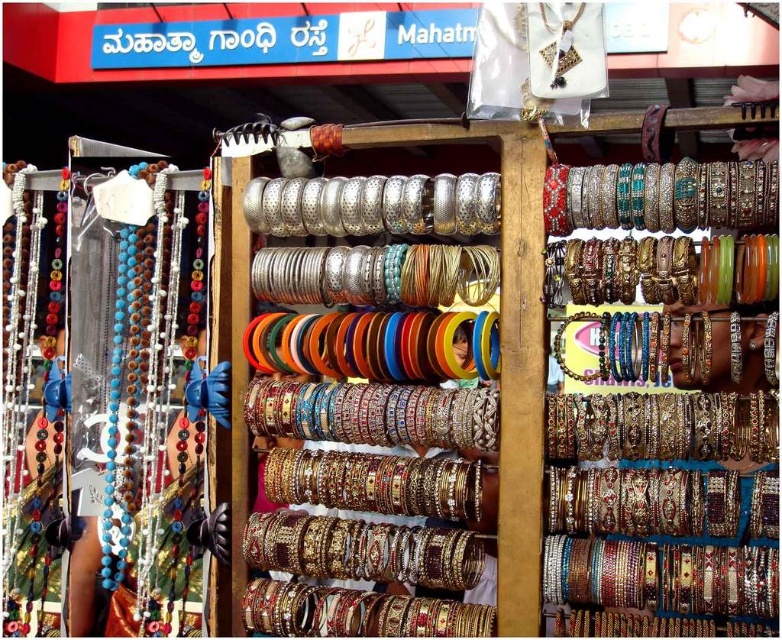
Is matte glass beads at left positioned in front of multicolored beaded bangles at center?

No.

Does matte glass beads at left come behind multicolored beaded bangles at center?

Yes, matte glass beads at left is behind multicolored beaded bangles at center.

From the picture: Who is more forward, [138,332] or [755,186]?

Positioned in front is point [755,186].

The image size is (782, 640). I want to click on matte glass beads at left, so click(92, 380).

How much distance is there between multicolored beaded bangles at center and metallic bangles at center?

multicolored beaded bangles at center is 15.32 inches away from metallic bangles at center.

Describe the element at coordinates (702, 317) in the screenshot. I see `multicolored beaded bangles at center` at that location.

Find the location of a particular element. multicolored beaded bangles at center is located at coordinates (702, 317).

Does matte glass beads at left appear on the right side of metallic bangles at center?

Incorrect, matte glass beads at left is not on the right side of metallic bangles at center.

Does matte glass beads at left come in front of metallic bangles at center?

No, matte glass beads at left is behind metallic bangles at center.

Image resolution: width=782 pixels, height=640 pixels. Describe the element at coordinates (92, 380) in the screenshot. I see `matte glass beads at left` at that location.

At what (x,y) coordinates should I click in order to perform the action: click on matte glass beads at left. Please return your answer as a coordinate pair (x, y). Looking at the image, I should click on (92, 380).